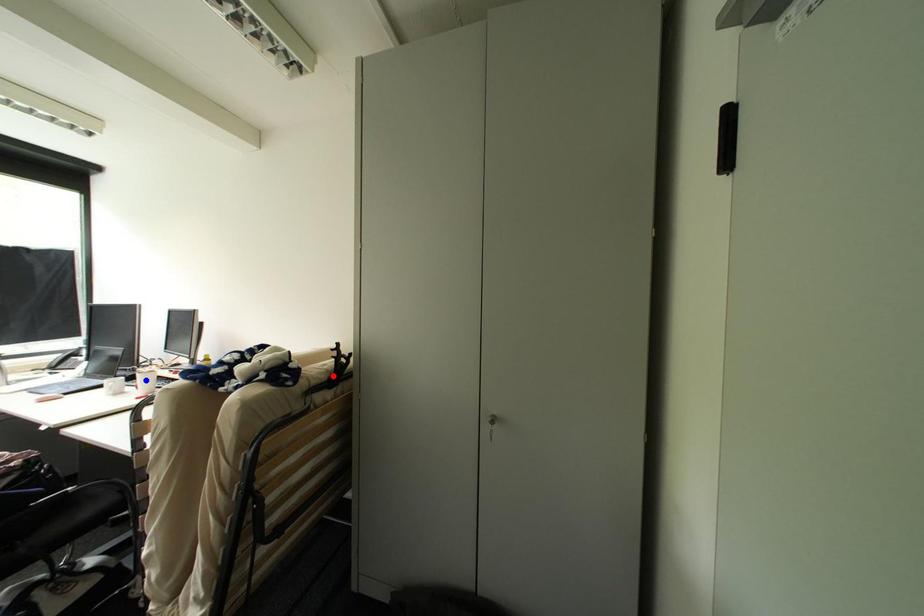
Question: In the image, two points are highlighted. Which point is nearer to the camera? Reply with the corresponding letter.

Choices:
 (A) blue point
 (B) red point

Answer: (B)